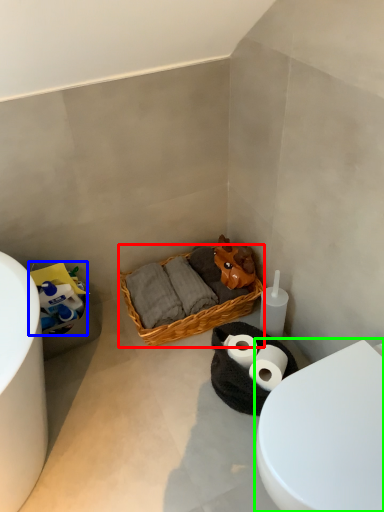
Question: Based on their relative distances, which object is nearer to picnic basket (highlighted by a red box)? Choose from toilet paper (highlighted by a blue box) and toilet (highlighted by a green box).

Choices:
 (A) toilet paper
 (B) toilet

Answer: (A)